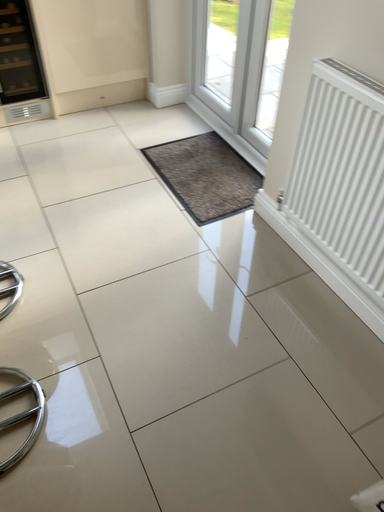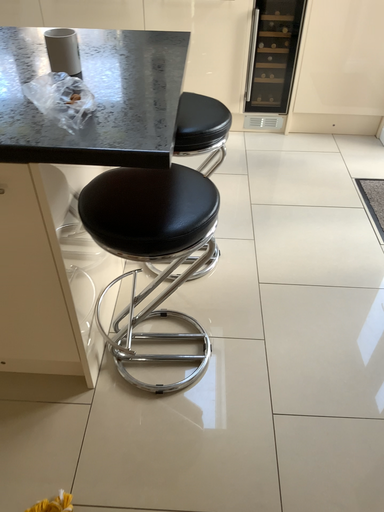
Question: Which way did the camera rotate in the video?

Choices:
 (A) rotated upward
 (B) rotated downward

Answer: (A)